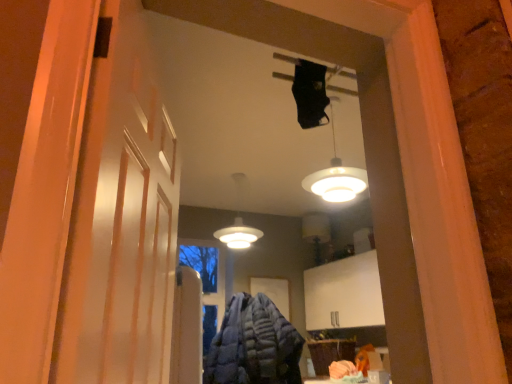
Question: Considering the relative positions of white matte lamp at center, acting as the second lamp starting from the front, and white glossy lampshade at upper center, the 1th lamp positioned from the right, in the image provided, is white matte lamp at center, acting as the second lamp starting from the front, to the right of white glossy lampshade at upper center, the 1th lamp positioned from the right, from the viewer's perspective?

Choices:
 (A) no
 (B) yes

Answer: (A)

Question: From a real-world perspective, is white matte lamp at center, the first lamp when ordered from left to right, below white glossy lampshade at upper center, arranged as the first lamp when viewed from the front?

Choices:
 (A) no
 (B) yes

Answer: (B)

Question: Is white glossy lampshade at upper center, arranged as the first lamp when viewed from the front, a part of white matte lamp at center, the first lamp when ordered from left to right?

Choices:
 (A) yes
 (B) no

Answer: (B)

Question: Considering the relative sizes of white matte lamp at center, marked as the 2th lamp in a right-to-left arrangement, and white glossy lampshade at upper center, arranged as the first lamp when viewed from the front, in the image provided, is white matte lamp at center, marked as the 2th lamp in a right-to-left arrangement, wider than white glossy lampshade at upper center, arranged as the first lamp when viewed from the front,?

Choices:
 (A) yes
 (B) no

Answer: (A)

Question: Is the position of white matte lamp at center, marked as the first lamp in a back-to-front arrangement, more distant than that of white glossy lampshade at upper center, positioned as the second lamp in back-to-front order?

Choices:
 (A) yes
 (B) no

Answer: (A)

Question: Is white matte lamp at center, marked as the first lamp in a back-to-front arrangement, positioned with its back to white glossy lampshade at upper center, which appears as the second lamp when viewed from the left?

Choices:
 (A) yes
 (B) no

Answer: (B)

Question: Does white matte barn door at left have a smaller size compared to blue quilted jacket at center?

Choices:
 (A) no
 (B) yes

Answer: (B)

Question: From a real-world perspective, is white matte barn door at left physically above blue quilted jacket at center?

Choices:
 (A) yes
 (B) no

Answer: (A)

Question: Can we say white matte barn door at left lies outside blue quilted jacket at center?

Choices:
 (A) no
 (B) yes

Answer: (B)

Question: From the image's perspective, does white matte barn door at left appear lower than blue quilted jacket at center?

Choices:
 (A) yes
 (B) no

Answer: (B)

Question: Considering the relative positions of white matte barn door at left and blue quilted jacket at center in the image provided, is white matte barn door at left to the left of blue quilted jacket at center from the viewer's perspective?

Choices:
 (A) no
 (B) yes

Answer: (B)

Question: Is white matte barn door at left in contact with blue quilted jacket at center?

Choices:
 (A) no
 (B) yes

Answer: (A)

Question: Would you say blue quilted jacket at center is outside white matte barn door at left?

Choices:
 (A) no
 (B) yes

Answer: (B)